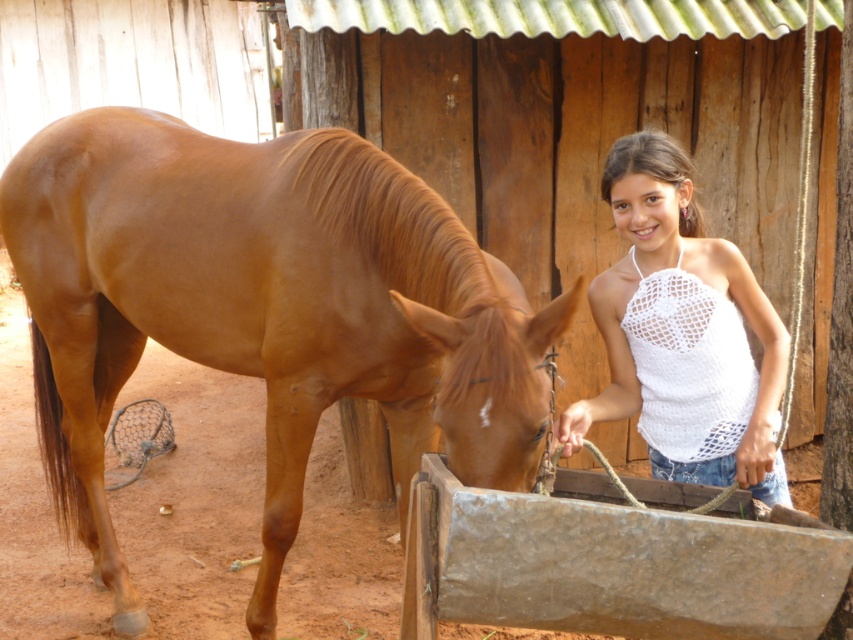
You are standing in the stable and want to place a small stool between the two points labeled point (85, 230) and point (764, 486). Which point should the stool be closer to in order to be closer to the camera?

The stool should be closer to point (85, 230) because it is further to the camera than point (764, 486).

You are a farmer who needs to secure a rope between the brown glossy horse at left and the white crochet tank top at center. The rope you have is 30 inches long. Will the rope be long enough?

The brown glossy horse at left is 31.86 inches away from the white crochet tank top at center. The rope is only 30 inches long, so it will not be long enough to secure between them.

You are standing in a stable and want to reach the point at coordinates point (48,150). If you can walk 5 meters in 1 minute, how long will it take you to reach that point?

The distance of point (48,150) from camera is 4.67 meters. Since you can walk 5 meters in 1 minute, it will take approximately 56 seconds to reach the point.